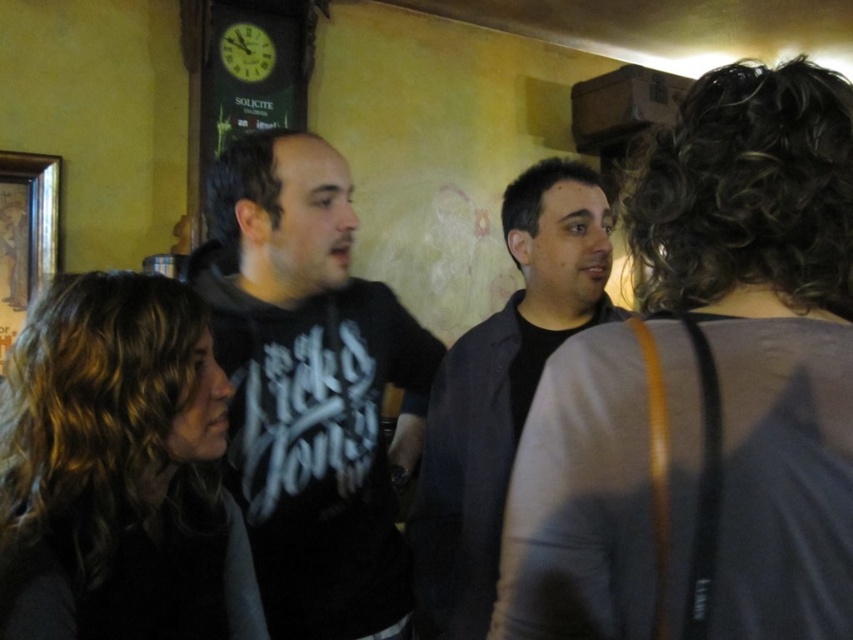
Question: Among these points, which one is farthest from the camera?

Choices:
 (A) (247, 412)
 (B) (521, 230)
 (C) (141, 595)

Answer: (B)

Question: Is dark brown hair at center closer to camera compared to dark gray jacket at center?

Choices:
 (A) no
 (B) yes

Answer: (B)

Question: Can you confirm if dark brown hair at center is positioned to the right of dark gray jacket at center?

Choices:
 (A) yes
 (B) no

Answer: (B)

Question: Does black matte shirt at center have a larger size compared to dark gray jacket at center?

Choices:
 (A) no
 (B) yes

Answer: (A)

Question: Which of these objects is positioned closest to the dark gray jacket at center?

Choices:
 (A) dark brown hair at center
 (B) black matte shirt at center
 (C) gray fabric purse at upper right

Answer: (B)

Question: Which object is farther from the camera taking this photo?

Choices:
 (A) gray fabric purse at upper right
 (B) dark gray jacket at center

Answer: (B)